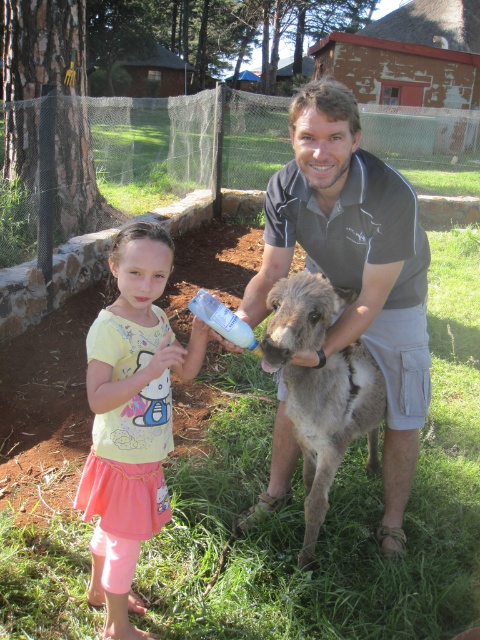
Question: Does dark gray shirt at center have a lesser width compared to yellow cotton shirt at left?

Choices:
 (A) no
 (B) yes

Answer: (A)

Question: Which point is closer to the camera taking this photo?

Choices:
 (A) (163, 358)
 (B) (225, 333)

Answer: (A)

Question: Does yellow cotton shirt at left have a smaller size compared to white plastic bottle at center?

Choices:
 (A) no
 (B) yes

Answer: (A)

Question: Which is nearer to the yellow cotton shirt at left?

Choices:
 (A) white plastic bottle at center
 (B) fuzzy gray donkey at center

Answer: (A)

Question: Estimate the real-world distances between objects in this image. Which object is closer to the fuzzy gray donkey at center?

Choices:
 (A) yellow cotton shirt at left
 (B) dark gray shirt at center
 (C) white plastic bottle at center

Answer: (B)

Question: Does dark gray shirt at center lie in front of fuzzy gray donkey at center?

Choices:
 (A) no
 (B) yes

Answer: (A)